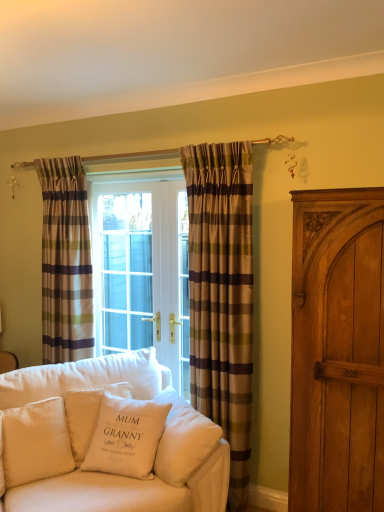
Question: Is plaid fabric curtain at center, the first curtain positioned from the front, located outside white quilted pillow at lower left, the fourth pillow when ordered from right to left?

Choices:
 (A) no
 (B) yes

Answer: (B)

Question: From a real-world perspective, does plaid fabric curtain at center, the first curtain positioned from the front, sit lower than white quilted pillow at lower left, the fourth pillow when ordered from right to left?

Choices:
 (A) yes
 (B) no

Answer: (B)

Question: From the image's perspective, is plaid fabric curtain at center, which is the second curtain from left to right, located above white quilted pillow at lower left, marked as the 1th pillow in a left-to-right arrangement?

Choices:
 (A) yes
 (B) no

Answer: (A)

Question: Does plaid fabric curtain at center, acting as the 1th curtain starting from the right, appear on the right side of white quilted pillow at lower left, the fourth pillow when ordered from right to left?

Choices:
 (A) yes
 (B) no

Answer: (A)

Question: Does plaid fabric curtain at center, the first curtain positioned from the front, have a lesser height compared to white quilted pillow at lower left, the fourth pillow when ordered from right to left?

Choices:
 (A) yes
 (B) no

Answer: (B)

Question: Based on their sizes in the image, would you say white soft cushion at lower left, the 4th pillow viewed from the left, is bigger or smaller than white cotton pillow at center, acting as the second pillow starting from the right?

Choices:
 (A) big
 (B) small

Answer: (A)

Question: Looking at their shapes, would you say white soft cushion at lower left, the 4th pillow viewed from the left, is wider or thinner than white cotton pillow at center, acting as the second pillow starting from the right?

Choices:
 (A) thin
 (B) wide

Answer: (A)

Question: From the image's perspective, relative to white cotton pillow at center, the 3th pillow in the left-to-right sequence, is white soft cushion at lower left, which appears as the 1th pillow when viewed from the right, above or below?

Choices:
 (A) above
 (B) below

Answer: (B)

Question: Is white soft cushion at lower left, the 4th pillow viewed from the left, to the left or to the right of white cotton pillow at center, acting as the second pillow starting from the right, in the image?

Choices:
 (A) left
 (B) right

Answer: (B)

Question: From their relative heights in the image, would you say white quilted pillow at lower left, the fourth pillow when ordered from right to left, is taller or shorter than white soft cushion at lower left, the 4th pillow viewed from the left?

Choices:
 (A) tall
 (B) short

Answer: (A)

Question: Relative to white soft cushion at lower left, the 4th pillow viewed from the left, is white quilted pillow at lower left, the fourth pillow when ordered from right to left, in front or behind?

Choices:
 (A) behind
 (B) front

Answer: (A)

Question: Is white quilted pillow at lower left, the fourth pillow when ordered from right to left, spatially inside white soft cushion at lower left, which appears as the 1th pillow when viewed from the right, or outside of it?

Choices:
 (A) inside
 (B) outside

Answer: (B)

Question: Would you say white quilted pillow at lower left, marked as the 1th pillow in a left-to-right arrangement, is to the left or to the right of white soft cushion at lower left, which appears as the 1th pillow when viewed from the right, in the picture?

Choices:
 (A) left
 (B) right

Answer: (A)

Question: In terms of height, does wooden carved cabinet at right look taller or shorter compared to plaid fabric curtain at center, which is the second curtain from left to right?

Choices:
 (A) short
 (B) tall

Answer: (A)

Question: Is wooden carved cabinet at right wider or thinner than plaid fabric curtain at center, the first curtain positioned from the front?

Choices:
 (A) thin
 (B) wide

Answer: (B)